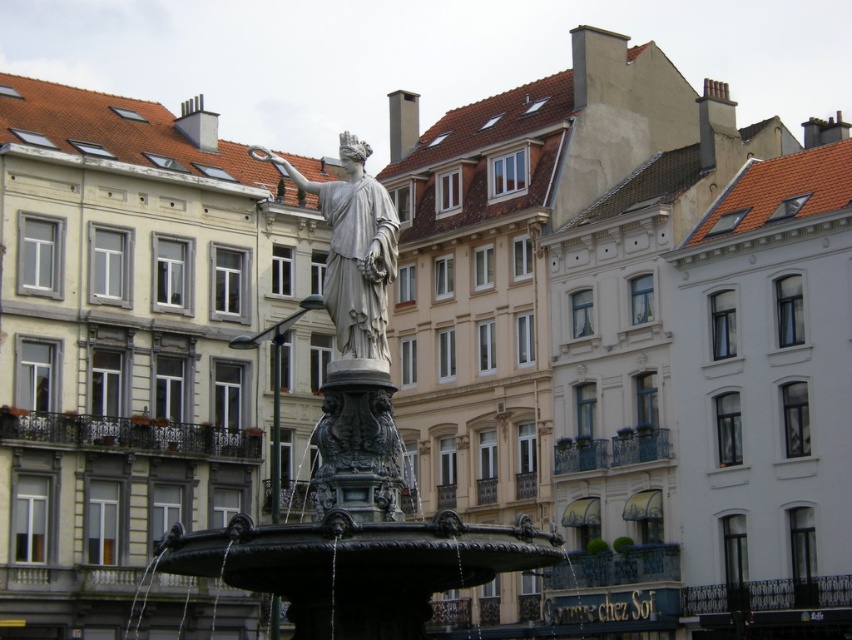
Question: Which point is closer to the camera?

Choices:
 (A) (274, 545)
 (B) (350, 220)

Answer: (A)

Question: Is bronze fountain at center wider than white marble statue at center?

Choices:
 (A) yes
 (B) no

Answer: (A)

Question: Does bronze fountain at center have a lesser width compared to white marble statue at center?

Choices:
 (A) no
 (B) yes

Answer: (A)

Question: Which point appears farthest from the camera in this image?

Choices:
 (A) pyautogui.click(x=360, y=330)
 (B) pyautogui.click(x=292, y=529)

Answer: (A)

Question: Among these objects, which one is nearest to the camera?

Choices:
 (A) bronze fountain at center
 (B) white marble statue at center

Answer: (A)

Question: Does bronze fountain at center appear on the left side of white marble statue at center?

Choices:
 (A) no
 (B) yes

Answer: (A)